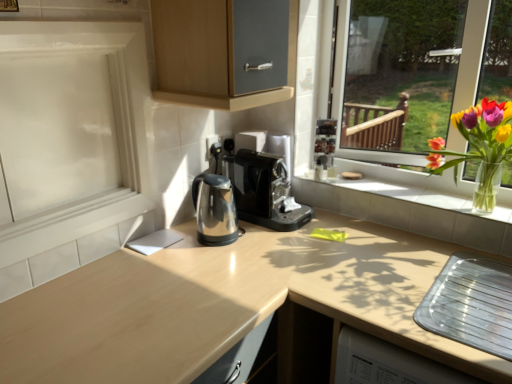
Image resolution: width=512 pixels, height=384 pixels. Identify the location of vacant space to the right of polished metallic kettle at center. (265, 245).